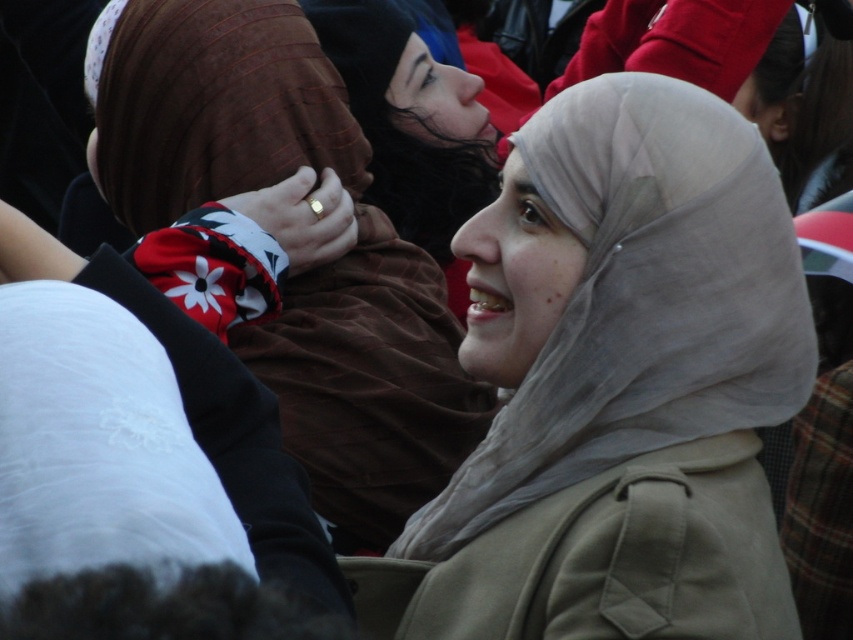
Describe the element at coordinates (641, 300) in the screenshot. This screenshot has width=853, height=640. I see `light beige sheer at center` at that location.

Between light beige sheer at center and matte brown scarf at center, which one has less height?

Standing shorter between the two is light beige sheer at center.

Is point (793, 289) closer to viewer compared to point (401, 422)?

Yes, it is in front of point (401, 422).

Locate an element on the screen. The image size is (853, 640). light beige sheer at center is located at coordinates (641, 300).